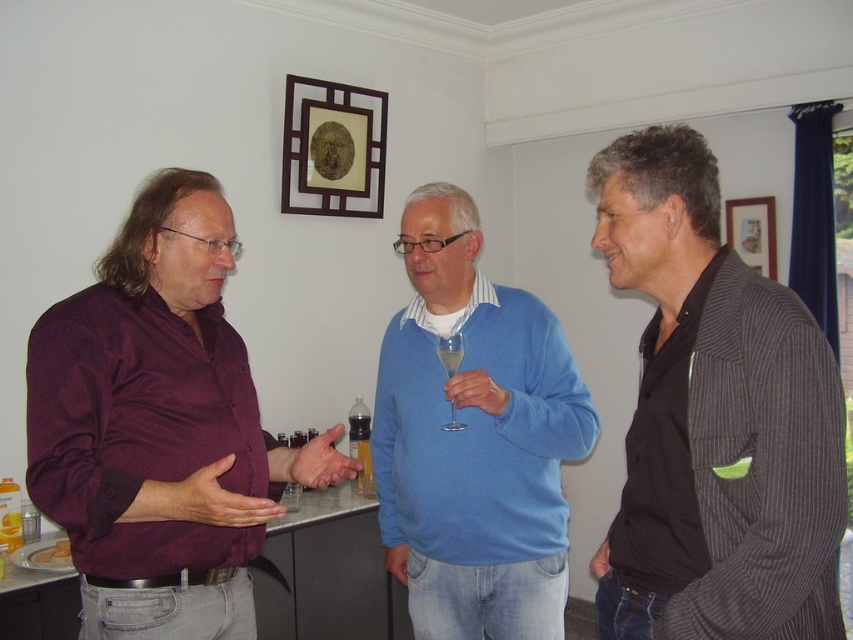
Can you confirm if blue sweater at center is wider than wooden picture frame at upper right?

Yes, blue sweater at center is wider than wooden picture frame at upper right.

Measure the distance between blue sweater at center and camera.

1.76 meters

Who is more forward, (554, 499) or (735, 200)?

Point (554, 499) is more forward.

You are a GUI agent. You are given a task and a screenshot of the screen. Output one action in this format:
    pyautogui.click(x=<x>, y=<y>)
    Task: Click on the blue sweater at center
    
    Given the screenshot: What is the action you would take?
    pyautogui.click(x=474, y=438)

Who is shorter, wooden picture frame at upper center or wooden picture frame at upper right?

Standing shorter between the two is wooden picture frame at upper right.

Based on the photo, can you confirm if wooden picture frame at upper center is wider than wooden picture frame at upper right?

Indeed, wooden picture frame at upper center has a greater width compared to wooden picture frame at upper right.

Does point (299, 170) come in front of point (762, 209)?

Yes, point (299, 170) is closer to viewer.

Locate an element on the screen. The image size is (853, 640). wooden picture frame at upper center is located at coordinates (334, 148).

Who is taller, striped wool blazer at right or blue sweater at center?

blue sweater at center

Locate an element on the screen. The height and width of the screenshot is (640, 853). striped wool blazer at right is located at coordinates (714, 419).

Locate an element on the screen. striped wool blazer at right is located at coordinates (714, 419).